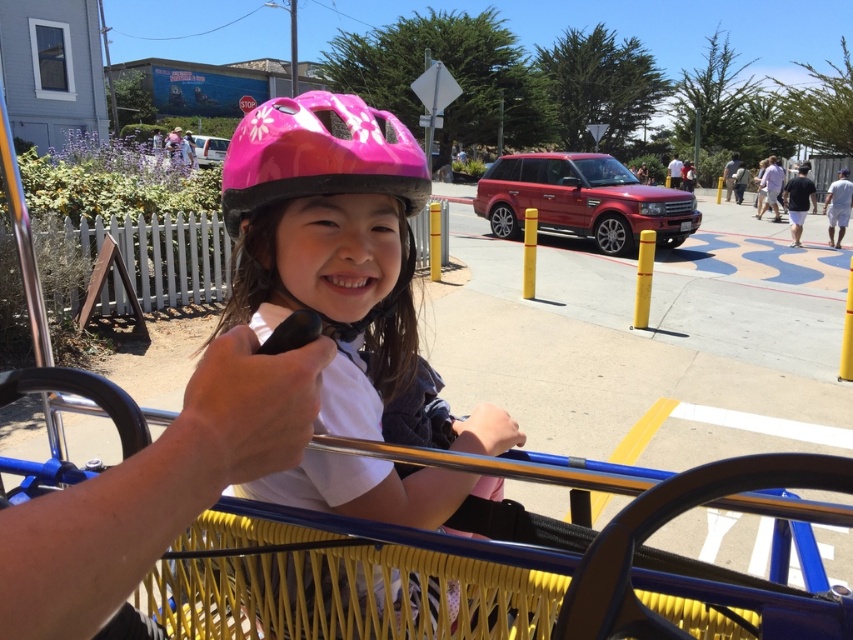
Based on the photo, you are a delivery person who needs to place a package in the yellow woven basket at center. However, the pink glossy bicycle helmet at center is currently blocking the basket. Can you place the package in the basket without moving the helmet?

The yellow woven basket at center is positioned under the pink glossy bicycle helmet at center, so the helmet is blocking access to the basket. Therefore, you cannot place the package in the basket without moving the helmet.

You are a photographer trying to capture a photo of the pink matte helmet at center and the yellow woven basket at center. Based on their positions, which object should you focus on first to ensure both are in the frame?

The yellow woven basket at center is behind the pink matte helmet at center, so you should focus on the pink matte helmet at center first to ensure both are in the frame.